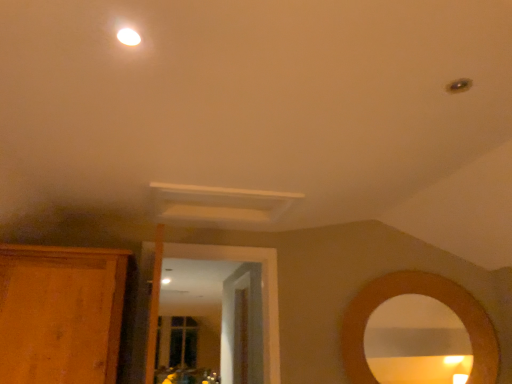
Question: From the image's perspective, is wooden cabinet at left under wooden door at center?

Choices:
 (A) yes
 (B) no

Answer: (B)

Question: Considering the relative sizes of wooden cabinet at left and wooden door at center in the image provided, is wooden cabinet at left taller than wooden door at center?

Choices:
 (A) yes
 (B) no

Answer: (B)

Question: Can you confirm if wooden cabinet at left is wider than wooden door at center?

Choices:
 (A) no
 (B) yes

Answer: (B)

Question: From the image's perspective, is wooden cabinet at left above wooden door at center?

Choices:
 (A) no
 (B) yes

Answer: (B)

Question: Considering the relative sizes of wooden cabinet at left and wooden door at center in the image provided, is wooden cabinet at left thinner than wooden door at center?

Choices:
 (A) yes
 (B) no

Answer: (B)

Question: From a real-world perspective, is wooden cabinet at left physically located above or below white glossy light fixture at upper center?

Choices:
 (A) above
 (B) below

Answer: (B)

Question: From the image's perspective, is wooden cabinet at left positioned above or below white glossy light fixture at upper center?

Choices:
 (A) below
 (B) above

Answer: (A)

Question: Is wooden cabinet at left taller or shorter than white glossy light fixture at upper center?

Choices:
 (A) short
 (B) tall

Answer: (B)

Question: Based on their sizes in the image, would you say wooden cabinet at left is bigger or smaller than white glossy light fixture at upper center?

Choices:
 (A) big
 (B) small

Answer: (A)

Question: In terms of width, does white glossy light fixture at upper center look wider or thinner when compared to wooden cabinet at left?

Choices:
 (A) wide
 (B) thin

Answer: (B)

Question: Is point (136, 44) positioned closer to the camera than point (104, 291)?

Choices:
 (A) closer
 (B) farther

Answer: (A)

Question: Is white glossy light fixture at upper center spatially inside wooden cabinet at left, or outside of it?

Choices:
 (A) outside
 (B) inside

Answer: (A)

Question: Based on their sizes in the image, would you say white glossy light fixture at upper center is bigger or smaller than wooden cabinet at left?

Choices:
 (A) small
 (B) big

Answer: (A)

Question: From their relative heights in the image, would you say wooden door at center is taller or shorter than wooden cabinet at left?

Choices:
 (A) short
 (B) tall

Answer: (B)

Question: Would you say wooden door at center is to the left or to the right of wooden cabinet at left in the picture?

Choices:
 (A) left
 (B) right

Answer: (B)